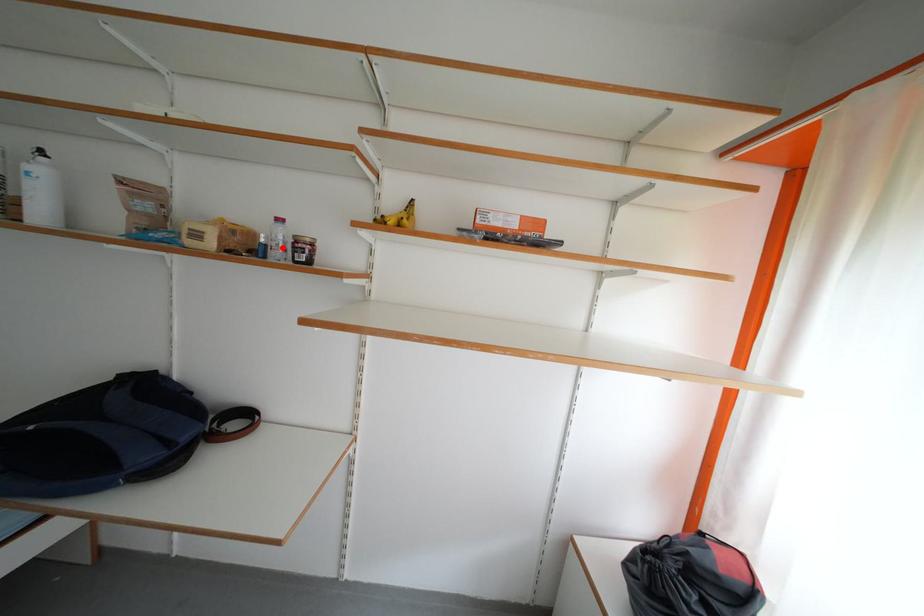
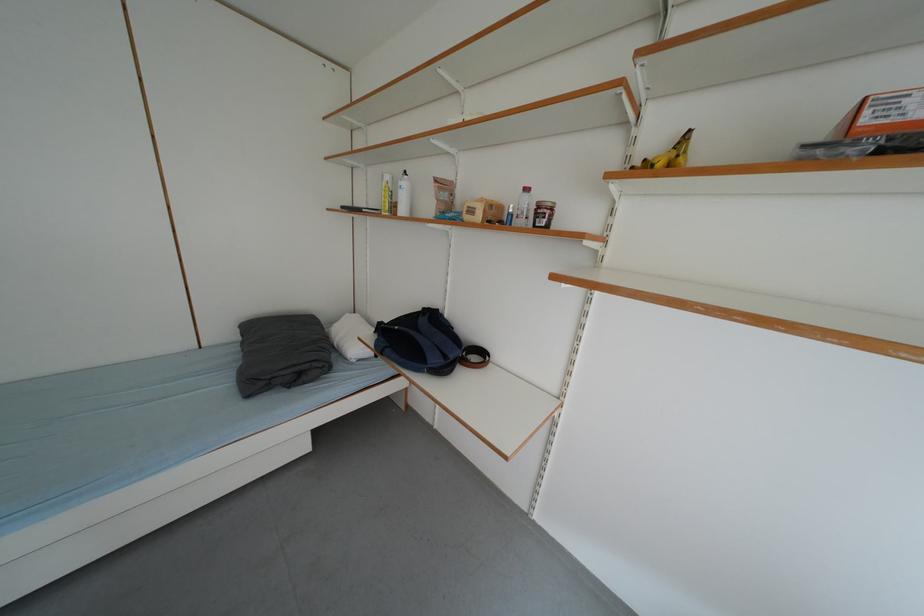
Where in the second image is the point corresponding to the highlighted location from the first image?

(528, 216)